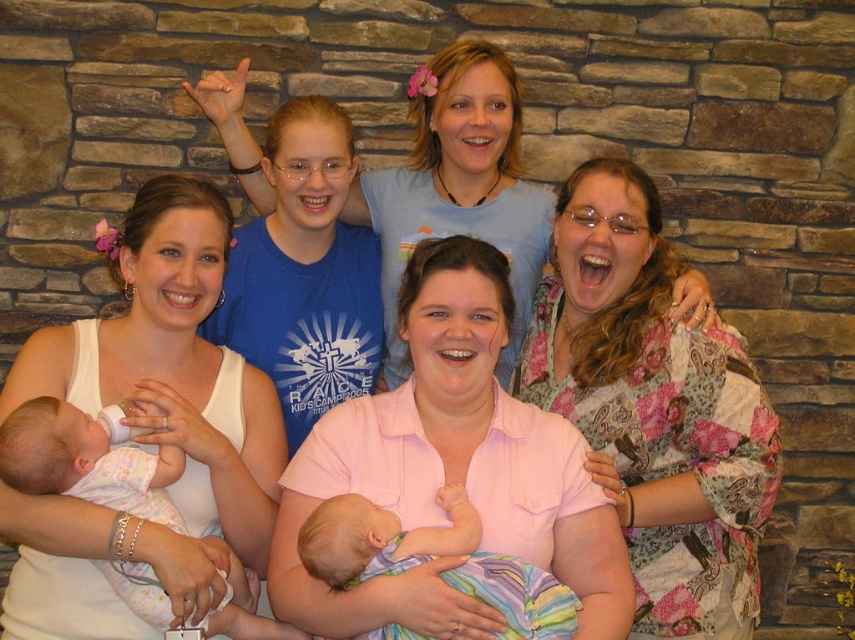
Question: Which object is the closest to the floral-patterned kimono at right?

Choices:
 (A) pink fabric shirt at center
 (B) white cotton onesie at lower left
 (C) soft pastel striped blanket at center

Answer: (A)

Question: Is the position of floral-patterned kimono at right more distant than that of pink fabric shirt at center?

Choices:
 (A) no
 (B) yes

Answer: (A)

Question: Is pink fabric shirt at center below soft pastel striped blanket at center?

Choices:
 (A) yes
 (B) no

Answer: (B)

Question: Which point is farther to the camera?

Choices:
 (A) soft pastel striped blanket at center
 (B) pink fabric shirt at center

Answer: (B)

Question: In this image, where is floral-patterned kimono at right located relative to white tank top at left?

Choices:
 (A) right
 (B) left

Answer: (A)

Question: Which point is farther to the camera?

Choices:
 (A) pink cotton shirt at center
 (B) floral-patterned kimono at right

Answer: (B)